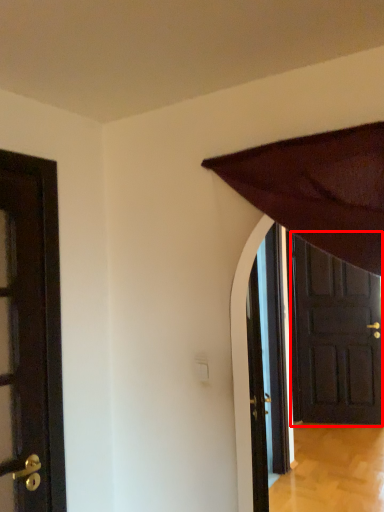
Question: In this image, where is door (annotated by the red box) located relative to door?

Choices:
 (A) right
 (B) left

Answer: (A)